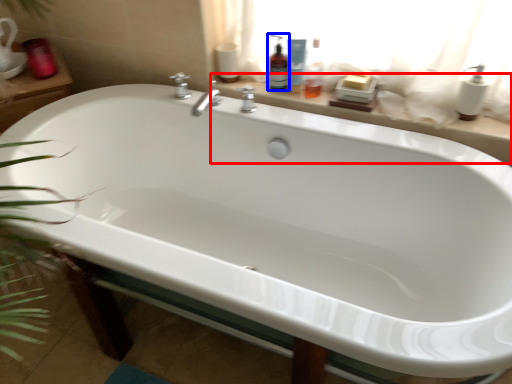
Question: Among these objects, which one is nearest to the camera, window sill (highlighted by a red box) or cleaning product (highlighted by a blue box)?

Choices:
 (A) window sill
 (B) cleaning product

Answer: (A)